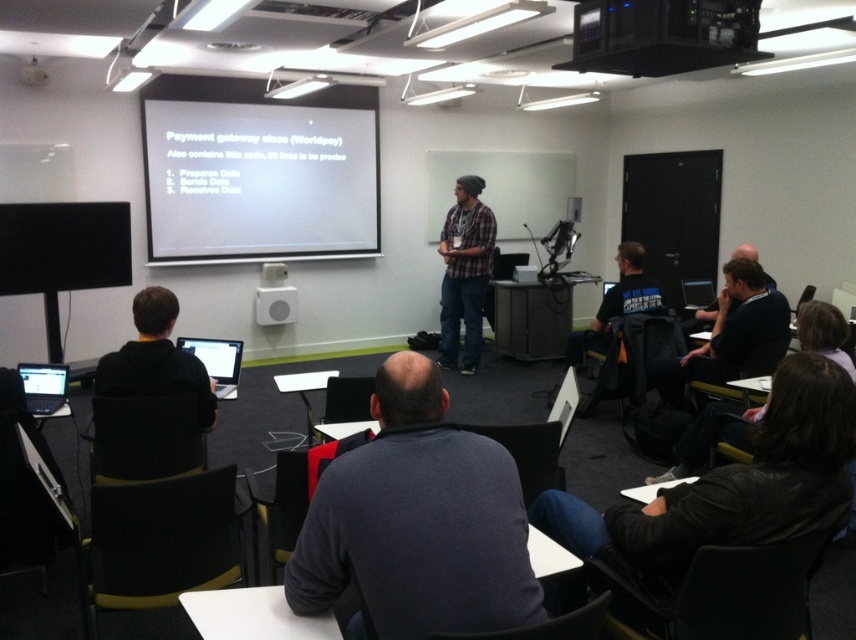
How far apart are dark gray sweater at center and black hoodie at left?

The distance of dark gray sweater at center from black hoodie at left is 5.68 feet.

Between dark gray sweater at center and black hoodie at left, which one is positioned lower?

Positioned lower is dark gray sweater at center.

Does point (480, 620) come farther from viewer compared to point (177, 362)?

No, (480, 620) is closer to viewer.

Identify the location of dark gray sweater at center. (418, 520).

What are the coordinates of `black leather jacket at lower right` in the screenshot? It's located at (729, 488).

Between black leather jacket at lower right and matte gray speaker at center, which one is positioned higher?

matte gray speaker at center

Who is more distant from viewer, [675,596] or [262,285]?

Point [262,285]

I want to click on black leather jacket at lower right, so click(x=729, y=488).

Who is more forward, (64, 388) or (272, 292)?

Point (64, 388)

Measure the distance between point (52,372) and camera.

3.53 meters

In order to click on matte black laptop at lower left in this screenshot , I will do (43, 387).